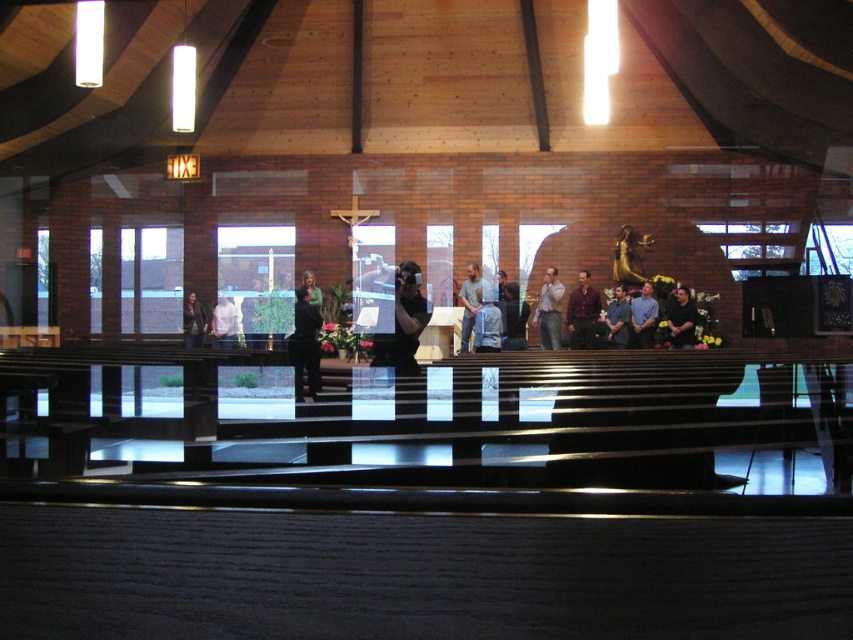
Question: Estimate the real-world distances between objects in this image. Which object is closer to the white shirt at center?

Choices:
 (A) dark gray shirt at center
 (B) matte black camera at center

Answer: (B)

Question: Which object is farther from the camera taking this photo?

Choices:
 (A) gray cotton shirt at center
 (B) light brown shirt at center

Answer: (B)

Question: Does dark suit at center lie in front of dark gray shirt at center?

Choices:
 (A) yes
 (B) no

Answer: (A)

Question: Which point appears closest to the camera in this image?

Choices:
 (A) (560, 308)
 (B) (587, 339)

Answer: (B)

Question: Is dark red shirt at center to the right of matte black jacket at left from the viewer's perspective?

Choices:
 (A) no
 (B) yes

Answer: (B)

Question: Is light brown shirt at center below white shirt at center?

Choices:
 (A) no
 (B) yes

Answer: (A)